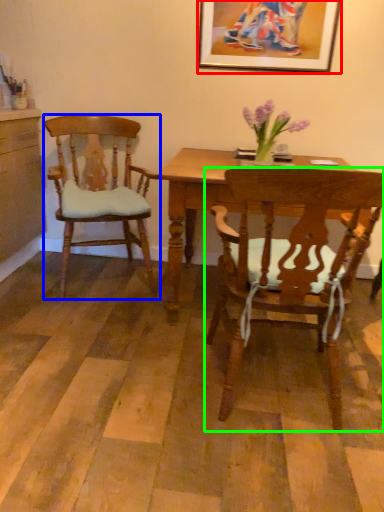
Question: Which object is the closest to the picture frame (highlighted by a red box)? Choose among these: chair (highlighted by a blue box) or chair (highlighted by a green box).

Choices:
 (A) chair
 (B) chair

Answer: (A)